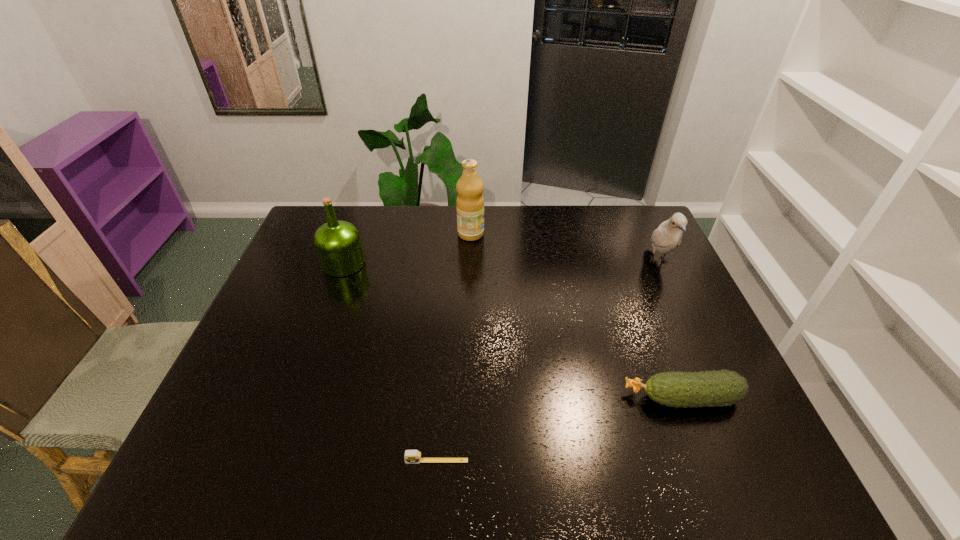
Identify the location of cucumber that is positioned at the right edge. This screenshot has width=960, height=540. (719, 388).

Where is `object situated at the far right corner`? This screenshot has width=960, height=540. object situated at the far right corner is located at coordinates (668, 235).

At what (x,y) coordinates should I click in order to perform the action: click on vacant space at the far edge. Please return your answer as a coordinate pair (x, y). Image resolution: width=960 pixels, height=540 pixels. Looking at the image, I should click on (583, 205).

Where is `vacant space at the near edge`? This screenshot has height=540, width=960. vacant space at the near edge is located at coordinates (560, 454).

Identify the location of vacant area at the left edge. The image size is (960, 540). (300, 306).

This screenshot has width=960, height=540. I want to click on free spot at the right edge of the desktop, so click(x=717, y=416).

Find the location of a particular element. free space at the far right corner is located at coordinates (627, 217).

This screenshot has height=540, width=960. In order to click on free spot between the nearest object and the right olive oil in this screenshot , I will do click(454, 347).

The width and height of the screenshot is (960, 540). I want to click on free space between the bird and the farther olive oil, so click(564, 248).

Find the location of a particular element. empty space that is in between the farther olive oil and the bird is located at coordinates (564, 248).